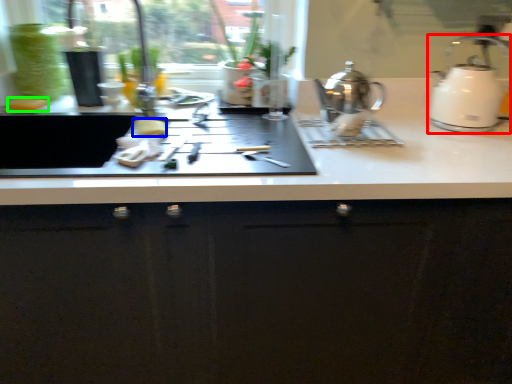
Question: Based on their relative distances, which object is farther from kettle (highlighted by a red box)? Choose from food (highlighted by a blue box) and food (highlighted by a green box).

Choices:
 (A) food
 (B) food

Answer: (B)